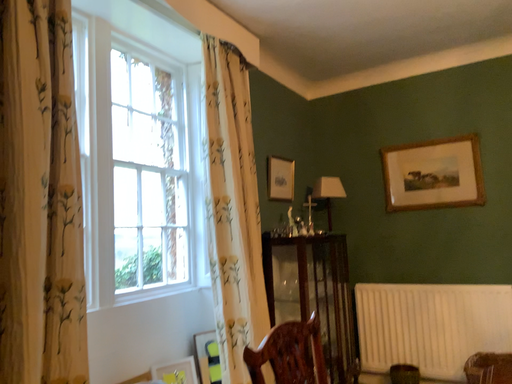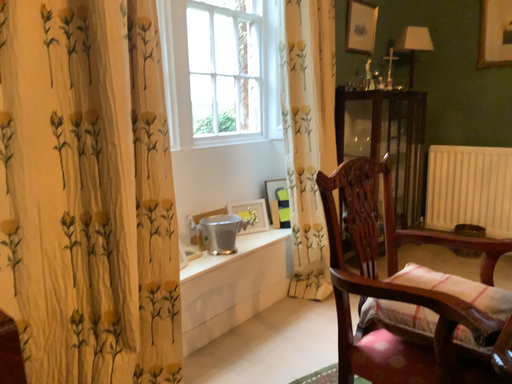
Question: Which way did the camera rotate in the video?

Choices:
 (A) rotated downward
 (B) rotated upward

Answer: (A)